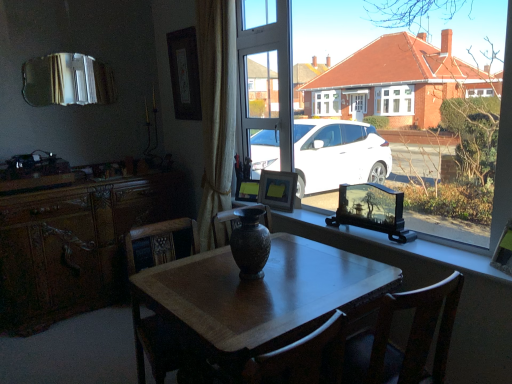
Locate an element on the screen. free point to the left of matte brown vase at center is located at coordinates (201, 278).